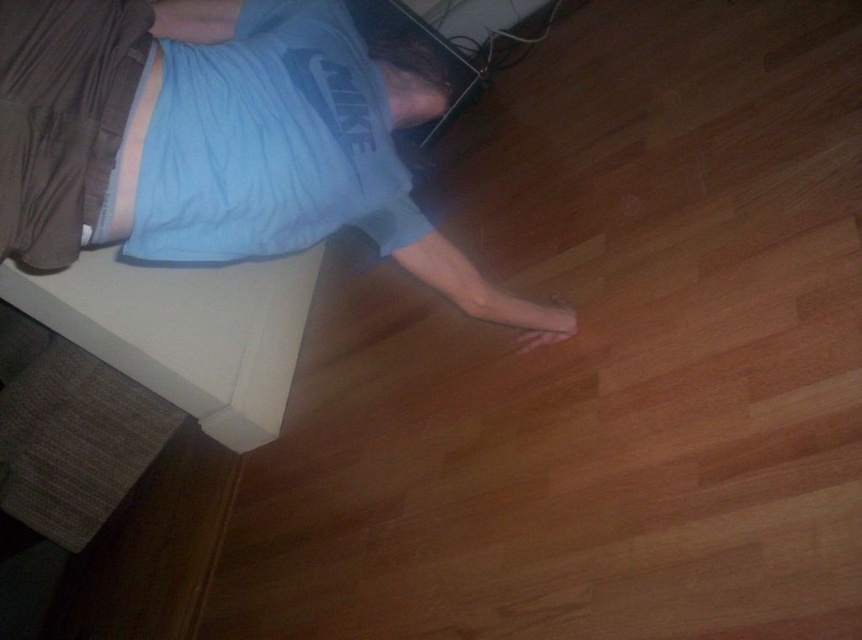
You are a photographer setting up a shoot in this room. You need to position a light source so that it illuminates the blue cotton shirt at lower center and the blue cotton shirt at upper left equally. Given their sizes, which shirt should you focus more light on and why?

The blue cotton shirt at lower center is much taller than the blue cotton shirt at upper left. To ensure equal illumination, you should focus more light on the blue cotton shirt at lower center because its larger size requires more light to achieve the same level of brightness as the smaller shirt.

You are a delivery person who needs to place a package on the floor between the blue cotton shirt at lower center and the blue cotton shirt at upper left. Based on the scene description, can you confirm if there is enough space between them to place the package?

The blue cotton shirt at lower center is below the blue cotton shirt at upper left, so there is vertical space between them. However, the scene description does not provide specific measurements of the distance between the shirts, so it is uncertain if the space is sufficient for placing the package.